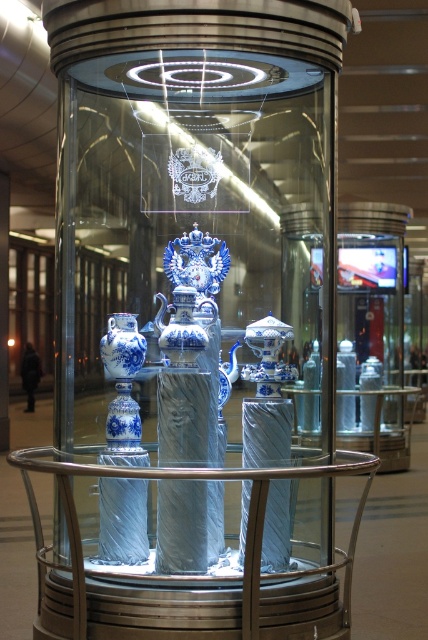
You are a museum curator who needs to place a new decorative item between the clear glass table at center and the blue porcelain teapot at center. What is the minimum distance you need to maintain between them to ensure the new item fits without touching either?

The clear glass table at center and blue porcelain teapot at center are 17.93 inches apart from each other. To place the new item between them without touching, the minimum distance required would be slightly more than half of 17.93 inches, which is approximately 8.96 inches. This ensures the item can fit in the space between them while maintaining a safe distance from both objects.

You are a museum curator who needs to place a new decorative item between the clear glass table at center and the blue porcelain vase at center in the display case. Given that the item is 15 inches wide, will it fit in the space between them?

The space between the clear glass table at center and the blue porcelain vase at center is 17.48 inches, so the 15 inches wide item will fit as it is narrower than the available space.

You are a museum curator planning to place a new decorative item on the clear glass table at center and the blue porcelain teapot at center. Given their sizes, which object can accommodate a larger item?

The clear glass table at center has a larger size compared to the blue porcelain teapot at center, so it can accommodate a larger item.